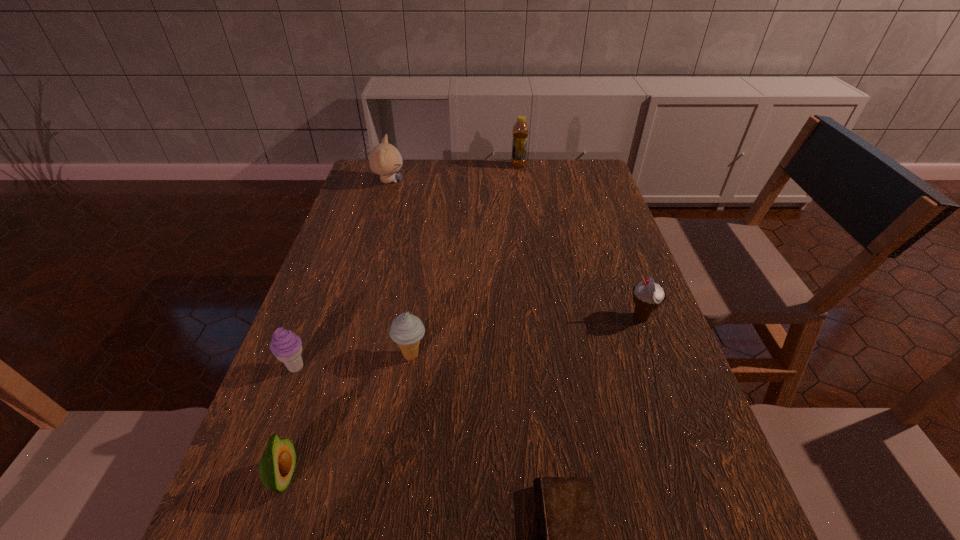
Find the location of a particular element. vacant region between the kitten and the leftmost icecream is located at coordinates (343, 274).

Identify the location of free spot between the leftmost icecream and the bottle. (407, 267).

In order to click on vacant area between the rightmost icecream and the avocado in this screenshot , I will do `click(463, 397)`.

Find the location of a particular element. free space between the leftmost icecream and the fourth object from right to left is located at coordinates (353, 361).

Choose which object is the sixth nearest neighbor to the avocado. Please provide its 2D coordinates. Your answer should be formatted as a tuple, i.e. [(x, y)], where the tuple contains the x and y coordinates of a point satisfying the conditions above.

[(520, 132)]

Locate which object ranks fourth in proximity to the avocado. Please provide its 2D coordinates. Your answer should be formatted as a tuple, i.e. [(x, y)], where the tuple contains the x and y coordinates of a point satisfying the conditions above.

[(648, 296)]

Where is `icecream object that ranks as the closest to the third farthest object`? The width and height of the screenshot is (960, 540). icecream object that ranks as the closest to the third farthest object is located at coordinates (406, 330).

Select which icecream is the second closest to the farthest icecream. Please provide its 2D coordinates. Your answer should be formatted as a tuple, i.e. [(x, y)], where the tuple contains the x and y coordinates of a point satisfying the conditions above.

[(287, 347)]

What are the coordinates of `free space that satisfies the following two spatial constraints: 1. on the face of the second icecream from left to right; 2. on the right side of the kitten` in the screenshot? It's located at (336, 355).

Locate an element on the screen. The width and height of the screenshot is (960, 540). vacant space that satisfies the following two spatial constraints: 1. on the face of the sixth nearest object; 2. on the right side of the fourth object from right to left is located at coordinates (336, 355).